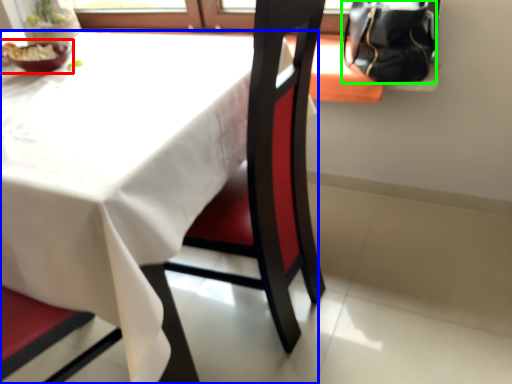
Question: Which object is the farthest from tableware (highlighted by a red box)? Choose among these: table (highlighted by a blue box) or handbag (highlighted by a green box).

Choices:
 (A) table
 (B) handbag

Answer: (B)